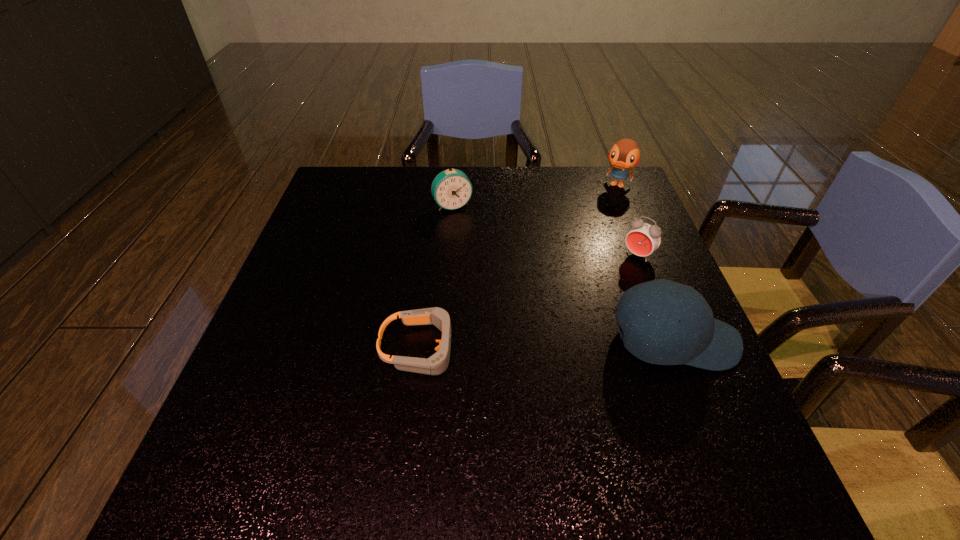
At what (x,y) coordinates should I click in order to perform the action: click on goggles. Please return your answer as a coordinate pair (x, y). The width and height of the screenshot is (960, 540). Looking at the image, I should click on (436, 364).

Locate an element on the screen. The width and height of the screenshot is (960, 540). baseball cap is located at coordinates (656, 336).

Image resolution: width=960 pixels, height=540 pixels. Identify the location of the nearer alarm clock. (644, 238).

In order to click on the right alarm clock in this screenshot , I will do `click(644, 238)`.

Find the location of a particular element. The image size is (960, 540). the farther alarm clock is located at coordinates (451, 189).

You are a GUI agent. You are given a task and a screenshot of the screen. Output one action in this format:
    pyautogui.click(x=<x>, y=<y>)
    Task: Click on the fourth nearest object
    This screenshot has height=540, width=960.
    Given the screenshot: What is the action you would take?
    pyautogui.click(x=451, y=189)

Locate an element on the screen. the farthest object is located at coordinates (625, 154).

Where is `free spot located 0.090m on the front and back of the goggles`? free spot located 0.090m on the front and back of the goggles is located at coordinates (506, 348).

At what (x,y) coordinates should I click in order to perform the action: click on vacant area situated 0.360m on the face of the right alarm clock. Please return your answer as a coordinate pair (x, y). Looking at the image, I should click on (545, 351).

Where is `vacant space located 0.330m on the face of the right alarm clock`? vacant space located 0.330m on the face of the right alarm clock is located at coordinates (554, 342).